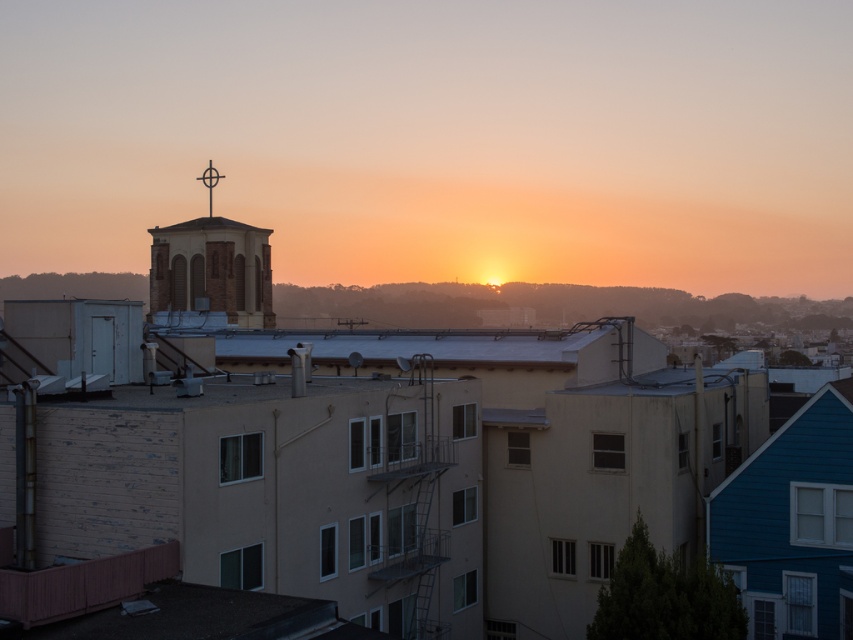
Question: Which point appears farthest from the camera in this image?

Choices:
 (A) (209, 161)
 (B) (256, 317)

Answer: (A)

Question: Which object appears closest to the camera in this image?

Choices:
 (A) metallic cross at upper center
 (B) brick steeple at upper center

Answer: (B)

Question: Does brick steeple at upper center appear on the right side of metallic cross at upper center?

Choices:
 (A) yes
 (B) no

Answer: (B)

Question: Does brick steeple at upper center lie behind metallic cross at upper center?

Choices:
 (A) yes
 (B) no

Answer: (B)

Question: Which object appears farthest from the camera in this image?

Choices:
 (A) brick steeple at upper center
 (B) metallic cross at upper center

Answer: (B)

Question: Can you confirm if brick steeple at upper center is positioned to the left of metallic cross at upper center?

Choices:
 (A) yes
 (B) no

Answer: (A)